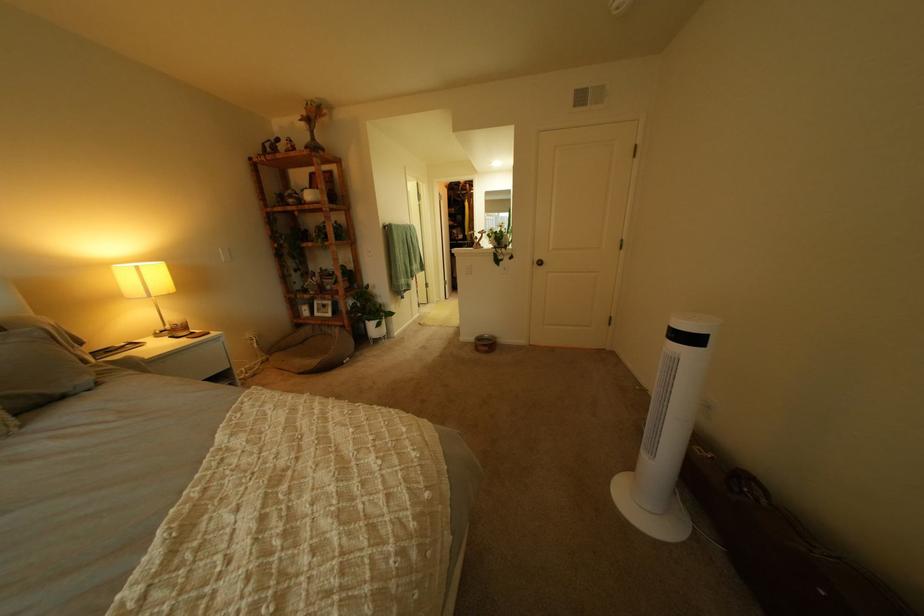
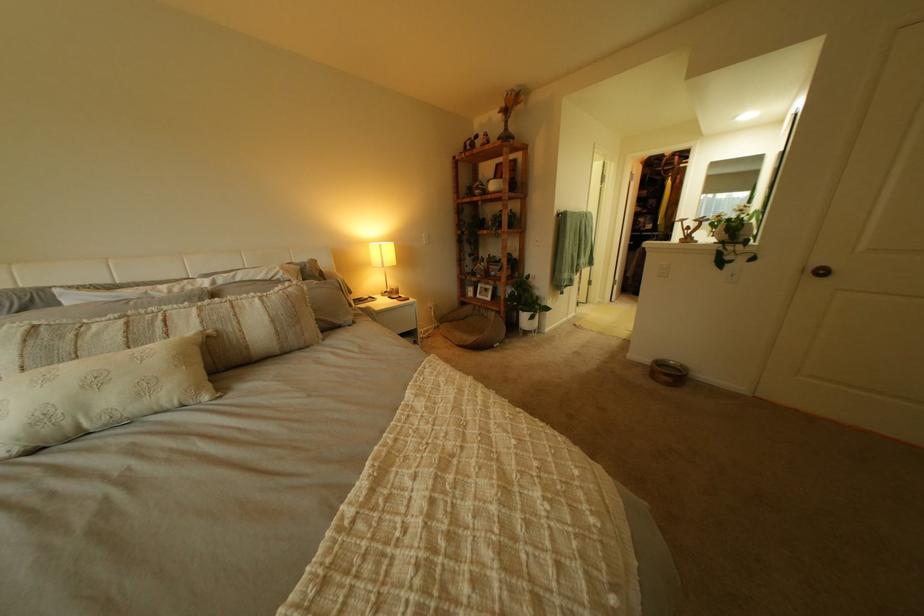
Where in the second image is the point corresponding to point 322,318 from the first image?

(485, 300)